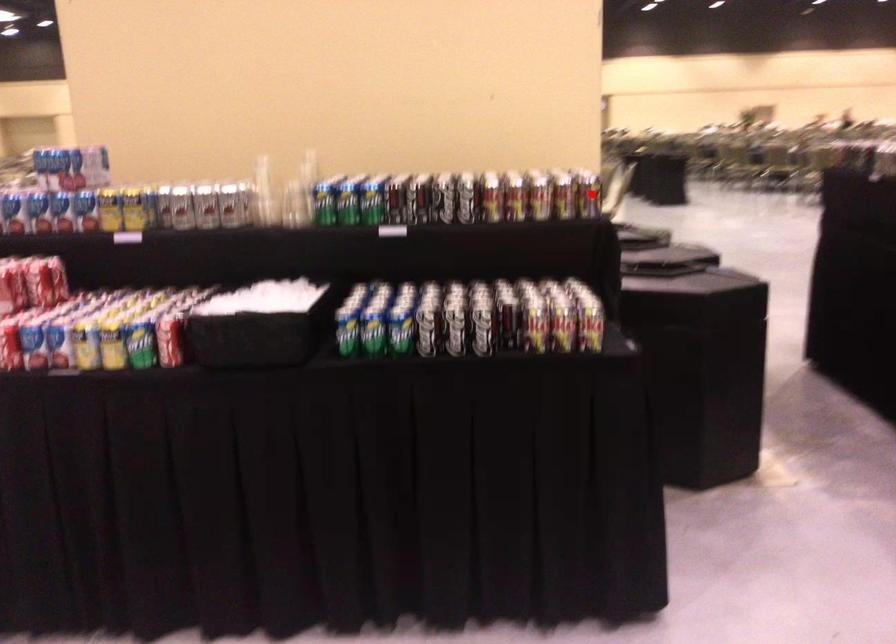
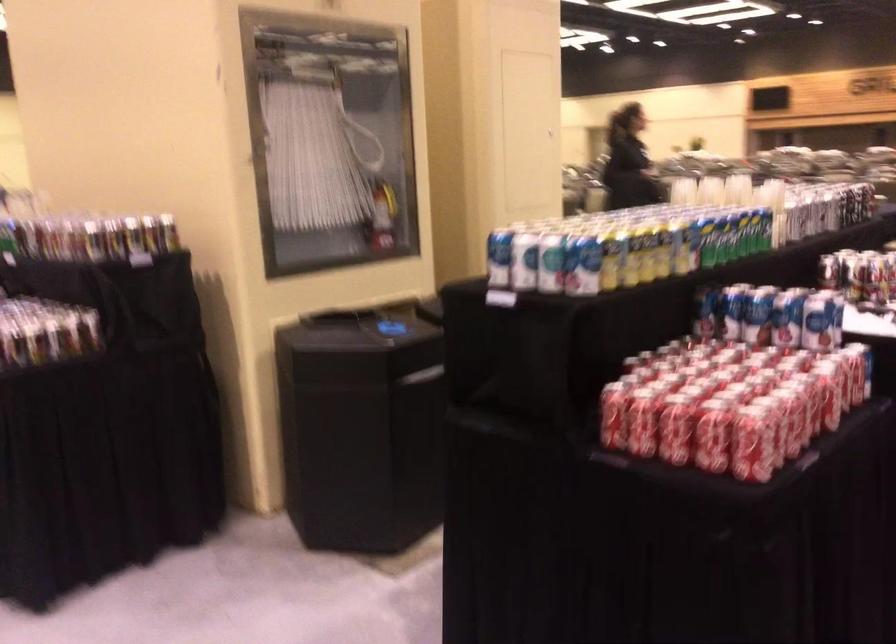
In the second image, find the point that corresponds to the highlighted location in the first image.

(131, 254)